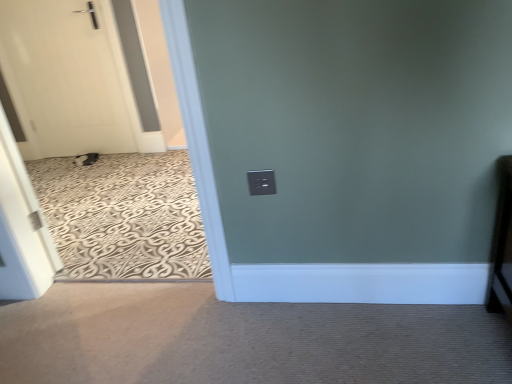
I want to click on white matte door at left, so point(63,79).

Image resolution: width=512 pixels, height=384 pixels. What do you see at coordinates (63, 79) in the screenshot?
I see `white matte door at left` at bounding box center [63, 79].

Locate an element on the screen. black plastic electric outlet at center is located at coordinates (261, 182).

Image resolution: width=512 pixels, height=384 pixels. What do you see at coordinates (261, 182) in the screenshot?
I see `black plastic electric outlet at center` at bounding box center [261, 182].

Locate an element on the screen. The width and height of the screenshot is (512, 384). white matte door at left is located at coordinates click(x=63, y=79).

Is white matte door at left to the left of black plastic electric outlet at center from the viewer's perspective?

Yes, white matte door at left is to the left of black plastic electric outlet at center.

Is the position of white matte door at left less distant than that of black plastic electric outlet at center?

No.

Which point is more forward, (41, 133) or (268, 186)?

The point (268, 186) is in front.

From the image's perspective, relative to black plastic electric outlet at center, is white matte door at left above or below?

white matte door at left is situated higher than black plastic electric outlet at center in the image.

From a real-world perspective, which is physically above, white matte door at left or black plastic electric outlet at center?

From a 3D spatial view, white matte door at left is above.

Looking at their sizes, would you say white matte door at left is wider or thinner than black plastic electric outlet at center?

Considering their sizes, white matte door at left looks broader than black plastic electric outlet at center.

Which of these two, white matte door at left or black plastic electric outlet at center, stands shorter?

Standing shorter between the two is black plastic electric outlet at center.

Does white matte door at left have a smaller size compared to black plastic electric outlet at center?

No, white matte door at left is not smaller than black plastic electric outlet at center.

Can we say white matte door at left lies outside black plastic electric outlet at center?

Indeed, white matte door at left is completely outside black plastic electric outlet at center.

Is white matte door at left not close to black plastic electric outlet at center?

Yes, white matte door at left is far from black plastic electric outlet at center.

Could you tell me if white matte door at left is facing black plastic electric outlet at center?

No, white matte door at left is not turned towards black plastic electric outlet at center.

Locate an element on the screen. The width and height of the screenshot is (512, 384). door located behind the black plastic electric outlet at center is located at coordinates (63, 79).

Visually, is black plastic electric outlet at center positioned to the left or to the right of white matte door at left?

black plastic electric outlet at center is positioned on white matte door at left's right side.

Does black plastic electric outlet at center come in front of white matte door at left?

Yes, black plastic electric outlet at center is closer to the camera.

Which is closer, (273, 174) or (89, 41)?

Point (273, 174) appears to be closer to the viewer than point (89, 41).

From the image's perspective, which object appears higher, black plastic electric outlet at center or white matte door at left?

white matte door at left.

From a real-world perspective, is black plastic electric outlet at center physically above white matte door at left?

No.

Which of these two, black plastic electric outlet at center or white matte door at left, is thinner?

black plastic electric outlet at center is thinner.

Does black plastic electric outlet at center have a lesser height compared to white matte door at left?

Correct, black plastic electric outlet at center is not as tall as white matte door at left.

Considering the sizes of objects black plastic electric outlet at center and white matte door at left in the image provided, who is bigger, black plastic electric outlet at center or white matte door at left?

With larger size is white matte door at left.

Would you say white matte door at left is part of black plastic electric outlet at center's contents?

No.

From the picture: Is black plastic electric outlet at center positioned far away from white matte door at left?

black plastic electric outlet at center is positioned a significant distance from white matte door at left.

Is black plastic electric outlet at center aimed at white matte door at left?

No, black plastic electric outlet at center is not turned towards white matte door at left.

Based on the photo, measure the distance from black plastic electric outlet at center to white matte door at left.

black plastic electric outlet at center and white matte door at left are 2.21 meters apart.

In order to click on door above the black plastic electric outlet at center (from the image's perspective) in this screenshot , I will do [63, 79].

Where is `electric outlet directly beneath the white matte door at left (from a real-world perspective)`? electric outlet directly beneath the white matte door at left (from a real-world perspective) is located at coordinates (261, 182).

This screenshot has height=384, width=512. I want to click on door located above the black plastic electric outlet at center (from the image's perspective), so click(x=63, y=79).